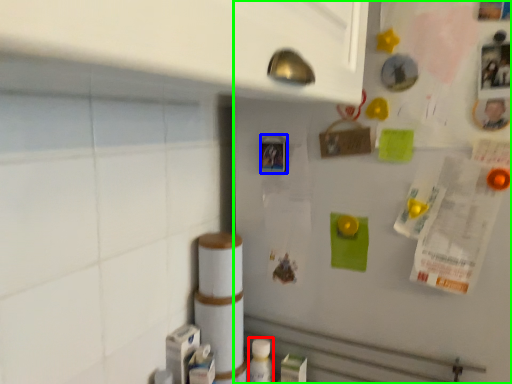
Question: Considering the real-world distances, which object is farthest from bottle (highlighted by a red box)? button (highlighted by a blue box) or fridge (highlighted by a green box)?

Choices:
 (A) button
 (B) fridge

Answer: (A)